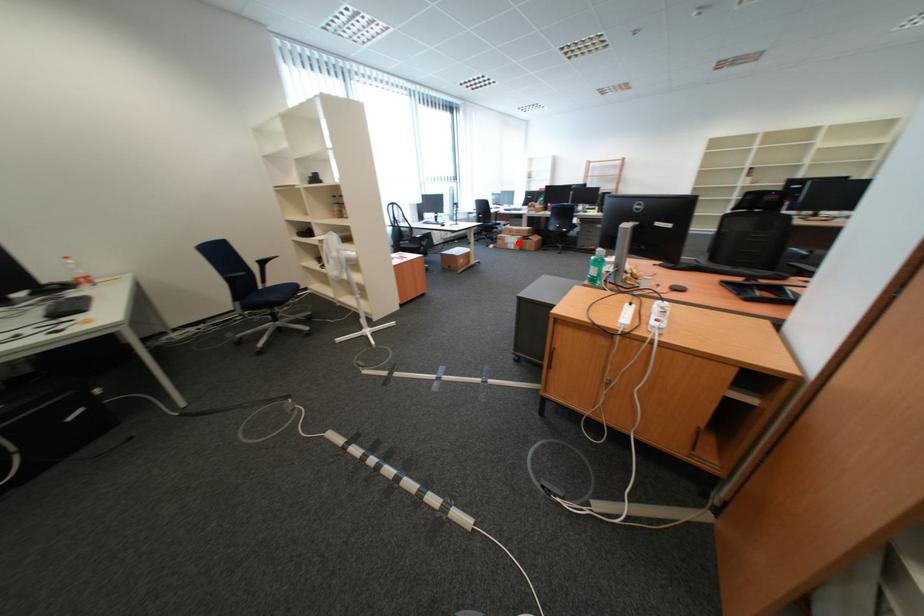
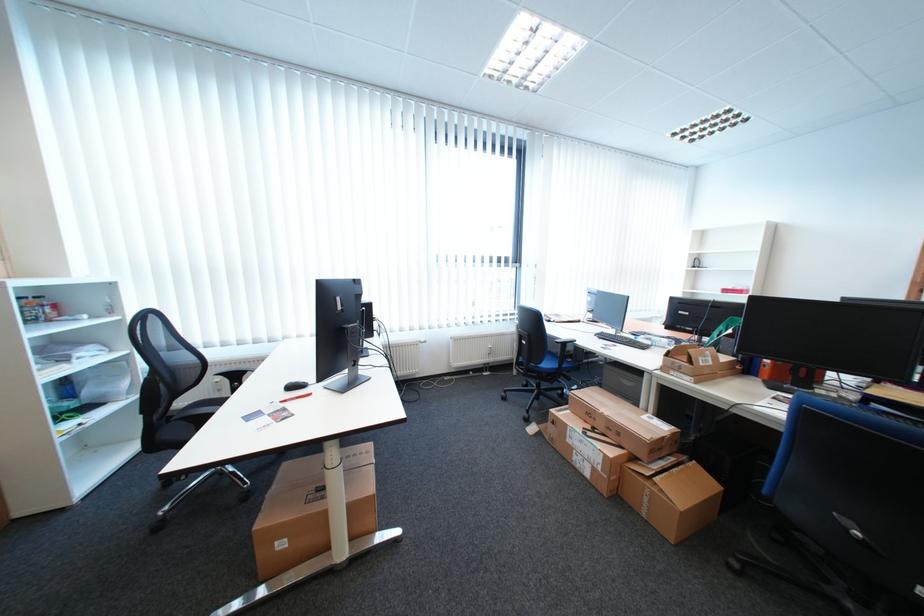
Question: I am providing you with two images of the same scene from different viewpoints. Given a red point in image1, look at the same physical point in image2. Is it:

Choices:
 (A) Closer to the viewpoint
 (B) Farther from the viewpoint

Answer: (B)